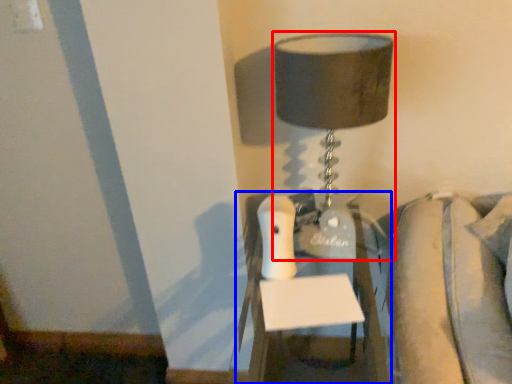
Question: Which of the following is the farthest to the observer, lamp (highlighted by a red box) or furniture (highlighted by a blue box)?

Choices:
 (A) lamp
 (B) furniture

Answer: (A)